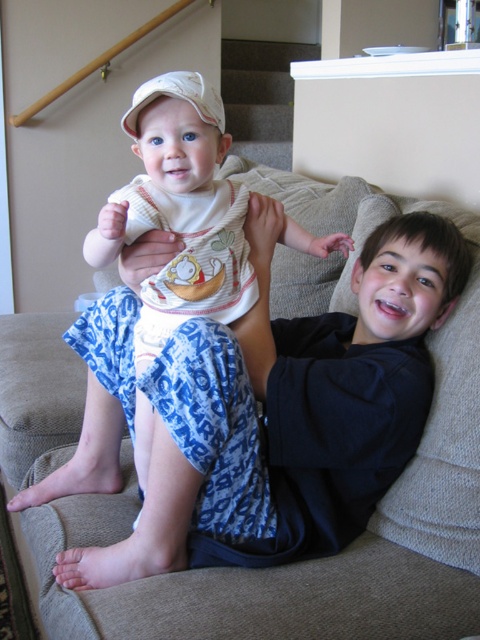
Question: Can you confirm if blue cotton pajama pants at center is positioned to the right of white cotton onesie at center?

Choices:
 (A) yes
 (B) no

Answer: (A)

Question: Is blue cotton pajama pants at center below white cotton onesie at center?

Choices:
 (A) no
 (B) yes

Answer: (B)

Question: Can you confirm if blue cotton pajama pants at center is positioned above white cotton onesie at center?

Choices:
 (A) yes
 (B) no

Answer: (B)

Question: Which point is farther to the camera?

Choices:
 (A) (385, 394)
 (B) (147, 172)

Answer: (A)

Question: Which object appears farthest from the camera in this image?

Choices:
 (A) white cotton onesie at center
 (B) blue cotton pajama pants at center

Answer: (B)